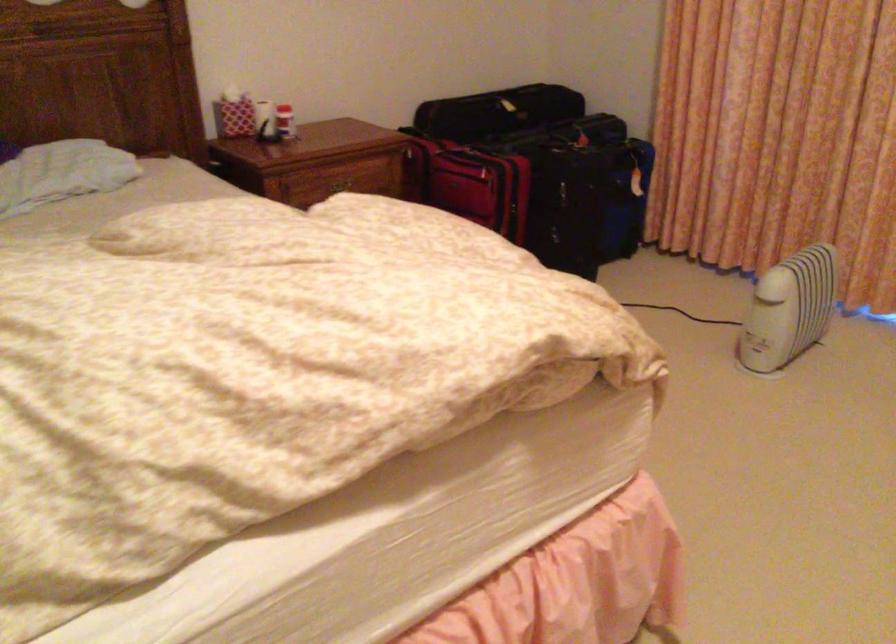
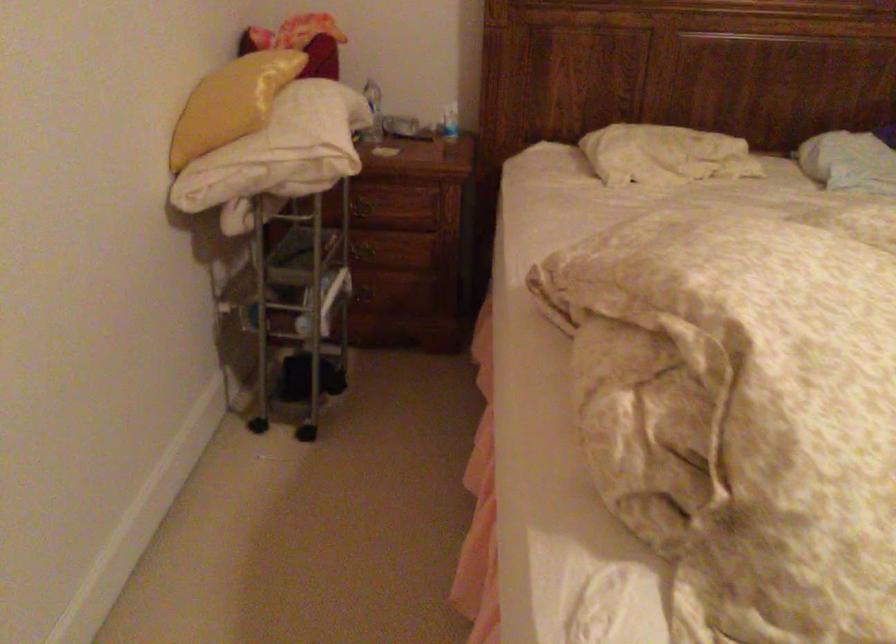
Question: How did the camera likely rotate?

Choices:
 (A) Left
 (B) Right
 (C) Up
 (D) Down

Answer: (A)